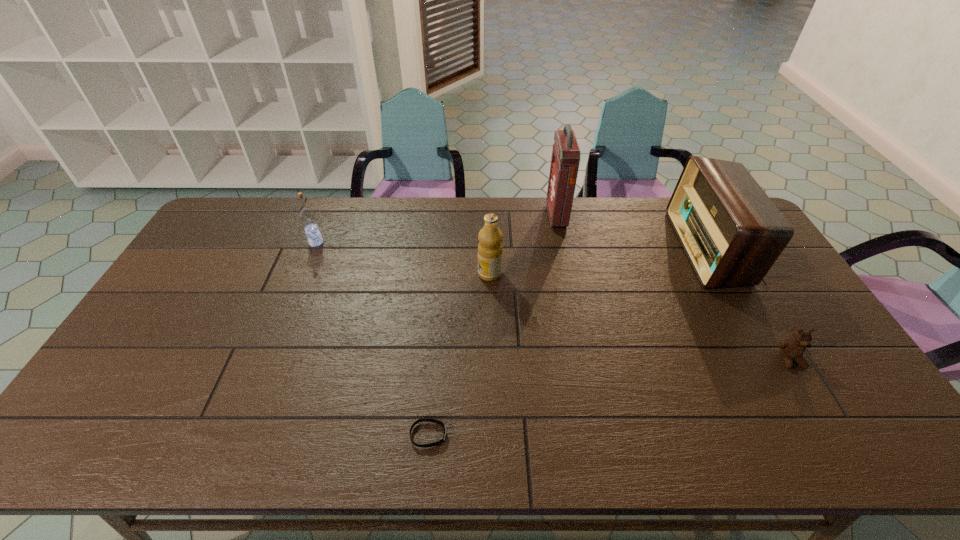
At what (x,y) coordinates should I click in order to perform the action: click on vacant space located 0.100m on the front-facing side of the tallest object. Please return your answer as a coordinate pair (x, y). Looking at the image, I should click on (521, 216).

The height and width of the screenshot is (540, 960). Identify the location of vacant space located on the front-facing side of the tallest object. (443, 216).

You are a GUI agent. You are given a task and a screenshot of the screen. Output one action in this format:
    pyautogui.click(x=<x>, y=<y>)
    Task: Click on the vacant point located on the front-facing side of the radio receiver
    Image resolution: width=960 pixels, height=540 pixels.
    Given the screenshot: What is the action you would take?
    pyautogui.click(x=608, y=248)

You are a GUI agent. You are given a task and a screenshot of the screen. Output one action in this format:
    pyautogui.click(x=<x>, y=<y>)
    Task: Click on the free region located 0.060m on the front-facing side of the radio receiver
    The width and height of the screenshot is (960, 540).
    Given the screenshot: What is the action you would take?
    pyautogui.click(x=664, y=248)

At what (x,y) coordinates should I click in order to perform the action: click on vacant region located 0.160m on the front-facing side of the radio receiver. Please return your answer as a coordinate pair (x, y). The width and height of the screenshot is (960, 540). Looking at the image, I should click on (635, 248).

Locate an element on the screen. The image size is (960, 540). vacant space positioned 0.210m on the label of the third object from left to right is located at coordinates [x=412, y=274].

The image size is (960, 540). Find the location of `free space located 0.080m on the label of the third object from left to right`. free space located 0.080m on the label of the third object from left to right is located at coordinates (453, 274).

Locate an element on the screen. This screenshot has width=960, height=540. blank space located on the label of the third object from left to right is located at coordinates (421, 274).

Locate an element on the screen. Image resolution: width=960 pixels, height=540 pixels. vacant region located on the back of the leftmost object is located at coordinates (333, 201).

Where is `free space located 0.090m at the face of the second nearest object`? free space located 0.090m at the face of the second nearest object is located at coordinates (815, 401).